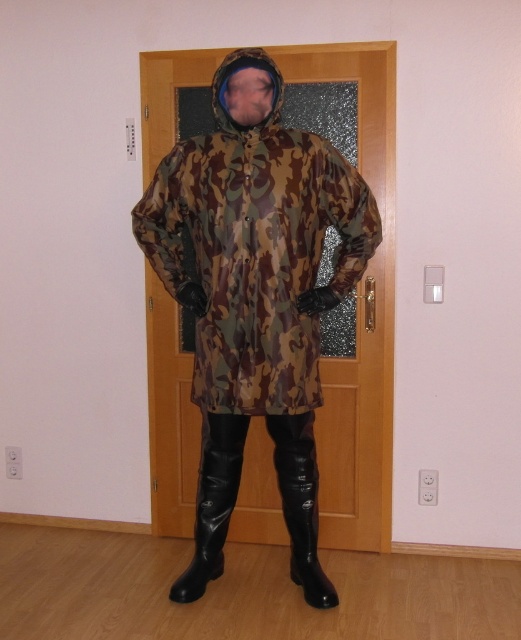
Does black patent leather boot at lower center have a lesser height compared to camo fabric hood at center?

No, black patent leather boot at lower center is not shorter than camo fabric hood at center.

Who is shorter, black patent leather boot at lower center or camo fabric hood at center?

camo fabric hood at center is shorter.

Who is more forward, (x=289, y=513) or (x=279, y=81)?

Positioned in front is point (x=279, y=81).

Find the location of a particular element. The width and height of the screenshot is (521, 640). black patent leather boot at lower center is located at coordinates (301, 502).

Is camouflage fabric jacket at center to the right of camo fabric hood at center from the viewer's perspective?

Yes, camouflage fabric jacket at center is to the right of camo fabric hood at center.

Looking at this image, between camouflage fabric jacket at center and camo fabric hood at center, which one has less height?

camo fabric hood at center

Identify the location of camouflage fabric jacket at center. This screenshot has height=640, width=521. (255, 250).

Is point (212, 481) positioned behind point (265, 120)?

Yes, it is.

Does black leather boot at lower center appear on the right side of camo fabric hood at center?

In fact, black leather boot at lower center is to the left of camo fabric hood at center.

Between point (220, 488) and point (230, 124), which one is positioned in front?

Positioned in front is point (230, 124).

I want to click on black leather boot at lower center, so click(x=213, y=500).